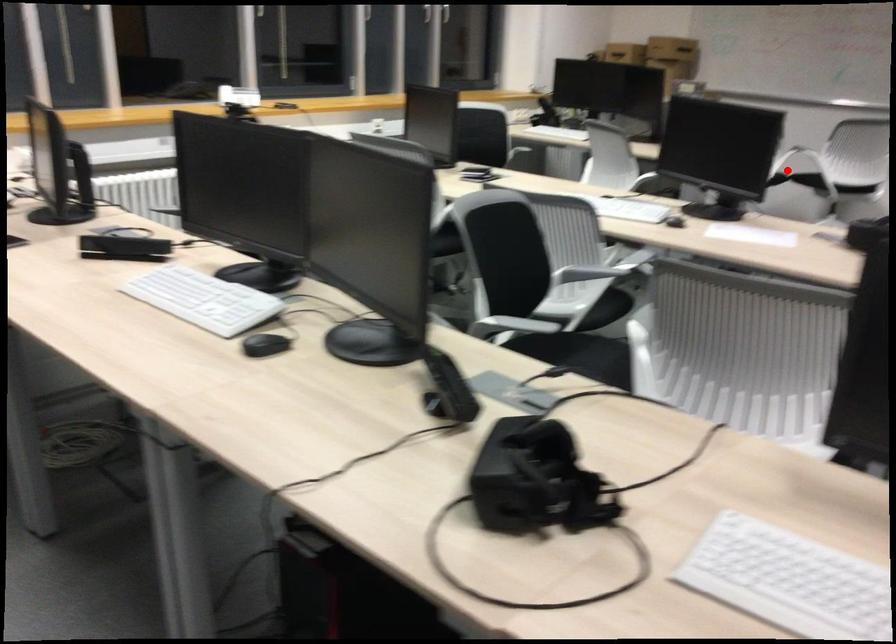
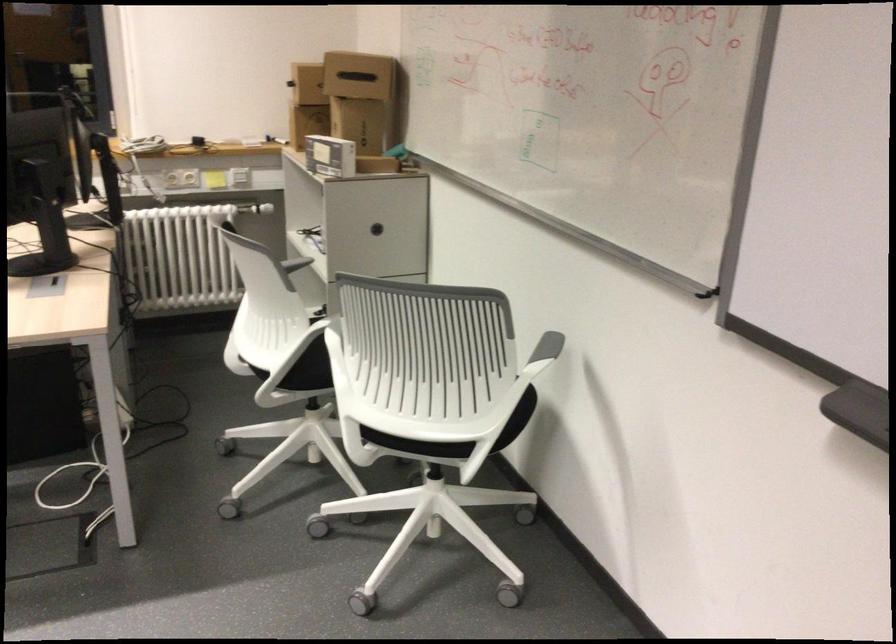
Question: I am providing you with two images of the same scene from different viewpoints. Image1 has a red point marked. In image2, the corresponding 3D location appears at what relative position? Reply with the corresponding letter.

Choices:
 (A) Closer
 (B) Farther

Answer: (A)